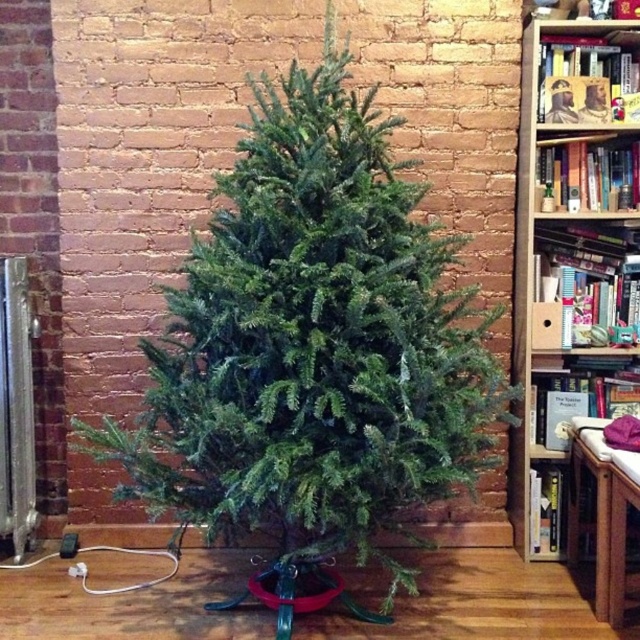
Question: Among these points, which one is nearest to the camera?

Choices:
 (A) (586, 326)
 (B) (314, 432)

Answer: (B)

Question: Can you confirm if green matte christmas tree at center is positioned to the right of wooden bookshelf at right?

Choices:
 (A) no
 (B) yes

Answer: (A)

Question: Observing the image, what is the correct spatial positioning of green matte christmas tree at center in reference to wooden bookshelf at right?

Choices:
 (A) left
 (B) right

Answer: (A)

Question: Can you confirm if green matte christmas tree at center is positioned to the right of wooden bookshelf at right?

Choices:
 (A) yes
 (B) no

Answer: (B)